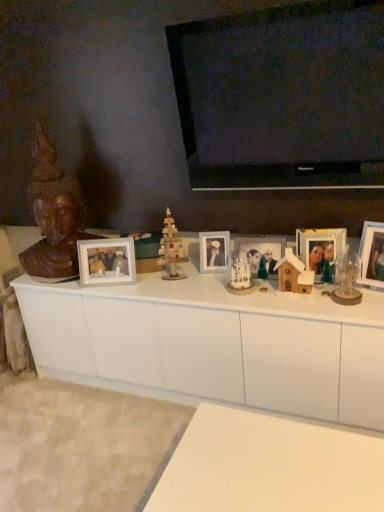
Where is `blank space to the left of white wooden house at center, the 3th toy when ordered from left to right`? This screenshot has width=384, height=512. blank space to the left of white wooden house at center, the 3th toy when ordered from left to right is located at coordinates (x=256, y=298).